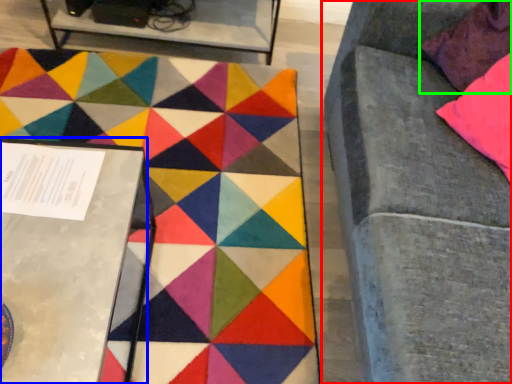
Question: Considering the real-world distances, which object is farthest from furniture (highlighted by a red box)? table (highlighted by a blue box) or pillow (highlighted by a green box)?

Choices:
 (A) table
 (B) pillow

Answer: (A)